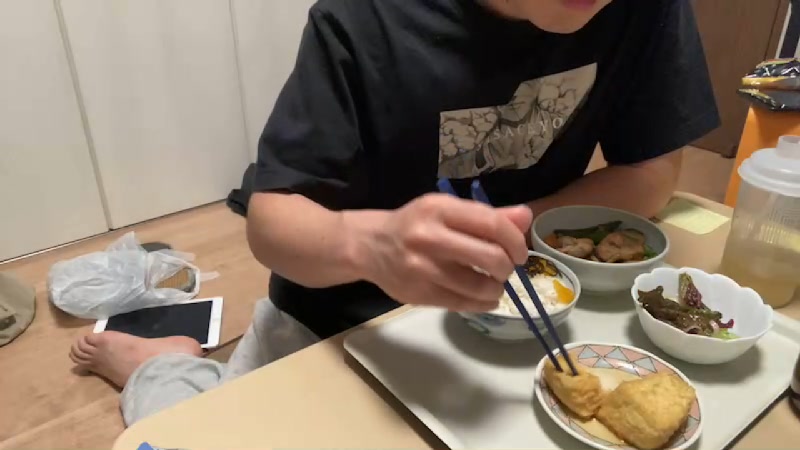
Identify the location of floor. The height and width of the screenshot is (450, 800). (238, 247).